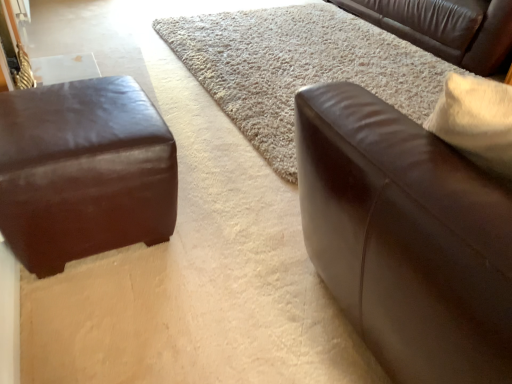
Question: Does matte brown leather ottoman at left, which appears as the third studio couch when viewed from the right, appear on the left side of beige shag rug at center?

Choices:
 (A) yes
 (B) no

Answer: (A)

Question: Can you confirm if matte brown leather ottoman at left, which appears as the third studio couch when viewed from the right, is shorter than beige shag rug at center?

Choices:
 (A) no
 (B) yes

Answer: (A)

Question: Considering the relative sizes of matte brown leather ottoman at left, which appears as the second studio couch when viewed from the front, and beige shag rug at center in the image provided, is matte brown leather ottoman at left, which appears as the second studio couch when viewed from the front, bigger than beige shag rug at center?

Choices:
 (A) yes
 (B) no

Answer: (B)

Question: From a real-world perspective, does matte brown leather ottoman at left, which appears as the second studio couch when viewed from the front, sit lower than beige shag rug at center?

Choices:
 (A) yes
 (B) no

Answer: (B)

Question: Does matte brown leather ottoman at left, arranged as the 2th studio couch when viewed from the back, have a greater height compared to beige shag rug at center?

Choices:
 (A) no
 (B) yes

Answer: (B)

Question: Is brown leather couch at right, which ranks as the third studio couch in back-to-front order, inside the boundaries of brown leather couch at upper right, the third studio couch from the left, or outside?

Choices:
 (A) inside
 (B) outside

Answer: (B)

Question: From a real-world perspective, relative to brown leather couch at upper right, the third studio couch from the left, is brown leather couch at right, which ranks as the third studio couch in back-to-front order, vertically above or below?

Choices:
 (A) above
 (B) below

Answer: (A)

Question: Visually, is brown leather couch at right, which ranks as the third studio couch in back-to-front order, positioned to the left or to the right of brown leather couch at upper right, which ranks as the 1th studio couch in right-to-left order?

Choices:
 (A) right
 (B) left

Answer: (B)

Question: From the image's perspective, relative to brown leather couch at upper right, which ranks as the 1th studio couch in right-to-left order, is brown leather couch at right, acting as the 2th studio couch starting from the left, above or below?

Choices:
 (A) above
 (B) below

Answer: (B)

Question: Looking at the image, does brown leather couch at upper right, which ranks as the 1th studio couch in right-to-left order, seem bigger or smaller compared to matte brown leather ottoman at left, which appears as the third studio couch when viewed from the right?

Choices:
 (A) small
 (B) big

Answer: (B)

Question: Is brown leather couch at upper right, acting as the third studio couch starting from the front, taller or shorter than matte brown leather ottoman at left, arranged as the 2th studio couch when viewed from the back?

Choices:
 (A) tall
 (B) short

Answer: (A)

Question: Is brown leather couch at upper right, acting as the third studio couch starting from the front, to the left or to the right of matte brown leather ottoman at left, which appears as the third studio couch when viewed from the right, in the image?

Choices:
 (A) right
 (B) left

Answer: (A)

Question: Considering the positions of point (328, 1) and point (36, 92), is point (328, 1) closer or farther from the camera than point (36, 92)?

Choices:
 (A) closer
 (B) farther

Answer: (B)

Question: Visually, is brown leather couch at upper right, acting as the 1th studio couch starting from the back, positioned to the left or to the right of beige shag rug at center?

Choices:
 (A) left
 (B) right

Answer: (B)

Question: Would you say brown leather couch at upper right, acting as the 1th studio couch starting from the back, is inside or outside beige shag rug at center?

Choices:
 (A) inside
 (B) outside

Answer: (B)